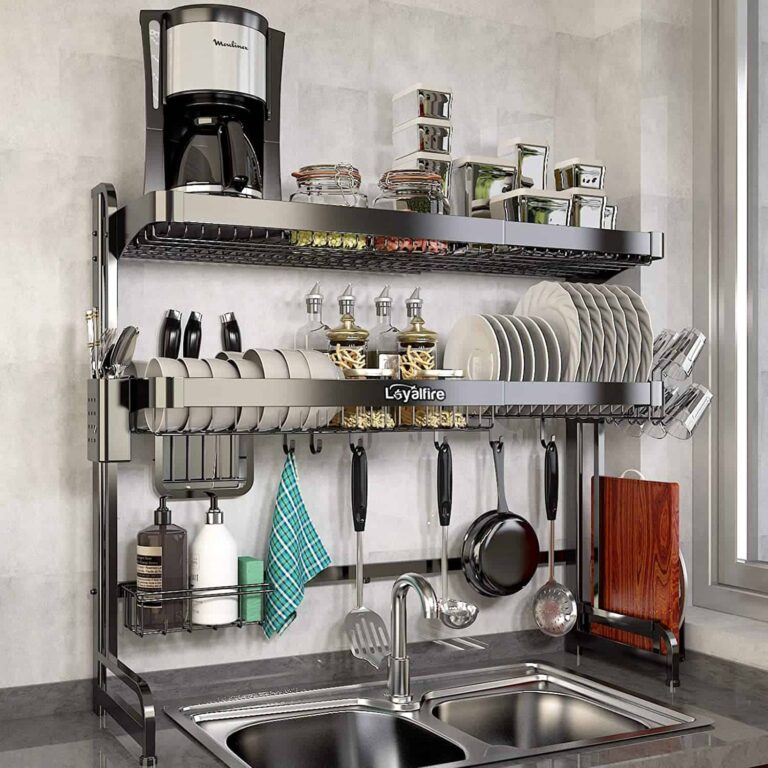
You are a GUI agent. You are given a task and a screenshot of the screen. Output one action in this format:
    pyautogui.click(x=<x>, y=<y>)
    Task: Click on the coffee maker
    
    Given the screenshot: What is the action you would take?
    pyautogui.click(x=237, y=81)